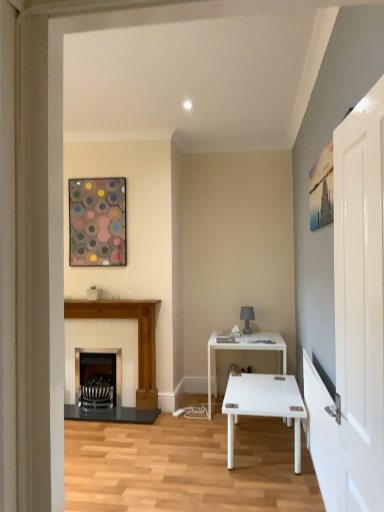
Question: Is white glossy door at right oriented towards matte gray lamp at center?

Choices:
 (A) yes
 (B) no

Answer: (B)

Question: Considering the relative sizes of white glossy door at right and matte gray lamp at center in the image provided, is white glossy door at right thinner than matte gray lamp at center?

Choices:
 (A) no
 (B) yes

Answer: (B)

Question: Is white glossy door at right closer to camera compared to matte gray lamp at center?

Choices:
 (A) yes
 (B) no

Answer: (A)

Question: Does white glossy door at right have a greater width compared to matte gray lamp at center?

Choices:
 (A) no
 (B) yes

Answer: (A)

Question: Can you confirm if white glossy door at right is smaller than matte gray lamp at center?

Choices:
 (A) no
 (B) yes

Answer: (A)

Question: Can you see white glossy door at right touching matte gray lamp at center?

Choices:
 (A) yes
 (B) no

Answer: (B)

Question: Is wooden fireplace at left, the first fireplace when ordered from right to left, shorter than matte gray lamp at center?

Choices:
 (A) no
 (B) yes

Answer: (A)

Question: Is wooden fireplace at left, the first fireplace when ordered from right to left, at the left side of matte gray lamp at center?

Choices:
 (A) yes
 (B) no

Answer: (A)

Question: Does wooden fireplace at left, placed as the second fireplace when sorted from left to right, lie behind matte gray lamp at center?

Choices:
 (A) no
 (B) yes

Answer: (A)

Question: Does wooden fireplace at left, placed as the second fireplace when sorted from left to right, have a greater height compared to matte gray lamp at center?

Choices:
 (A) no
 (B) yes

Answer: (B)

Question: From the image's perspective, is wooden fireplace at left, placed as the second fireplace when sorted from left to right, below matte gray lamp at center?

Choices:
 (A) yes
 (B) no

Answer: (A)

Question: Is wooden fireplace at left, placed as the second fireplace when sorted from left to right, oriented towards matte gray lamp at center?

Choices:
 (A) yes
 (B) no

Answer: (B)

Question: From the image's perspective, is wooden fireplace at left, the first fireplace when ordered from right to left, under metallic hexagonal artwork at upper left?

Choices:
 (A) yes
 (B) no

Answer: (A)